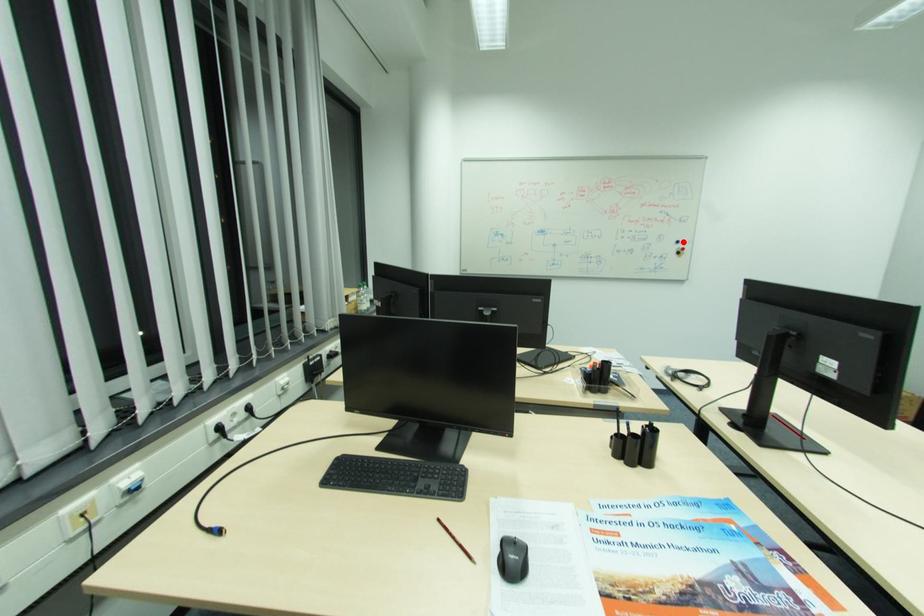
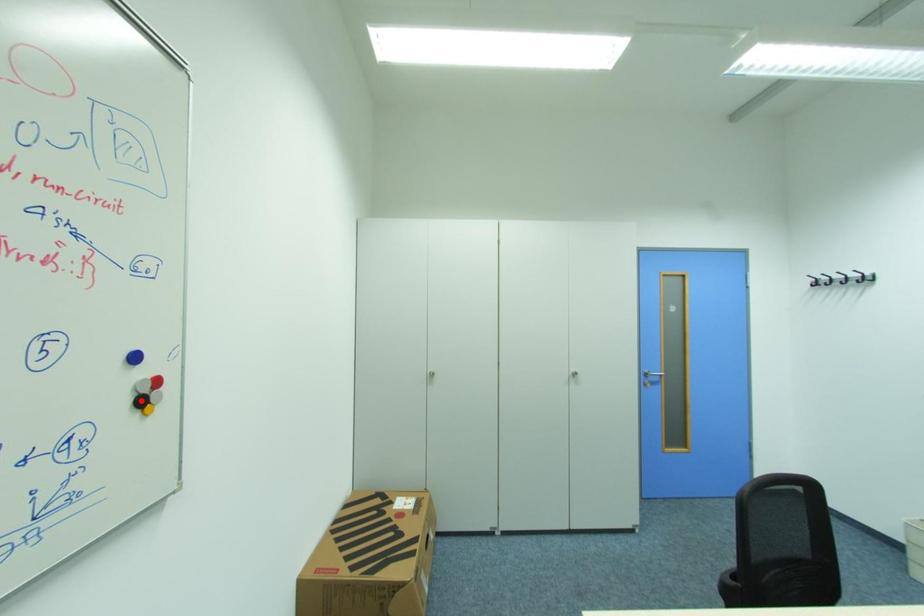
I am providing you with two images of the same scene from different viewpoints. A red point is marked on the first image and another point is marked on the second image. Does the point marked in image1 correspond to the same location as the one in image2?

No